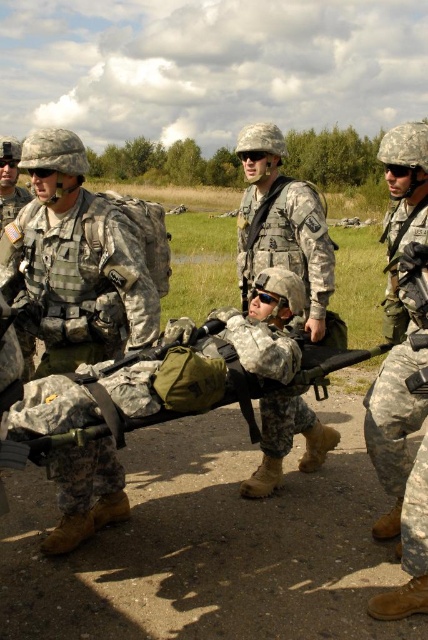
Question: Is the position of camouflage fabric uniform at center less distant than that of camouflage uniform at right?

Choices:
 (A) no
 (B) yes

Answer: (A)

Question: Is camouflage uniform at right to the right of camouflage uniform at center from the viewer's perspective?

Choices:
 (A) yes
 (B) no

Answer: (A)

Question: Among these points, which one is farthest from the camera?

Choices:
 (A) (412, 355)
 (B) (347, 364)

Answer: (A)

Question: Which of the following is the closest to the observer?

Choices:
 (A) (253, 204)
 (B) (398, 600)
 (C) (107, 516)

Answer: (B)

Question: Can you confirm if camouflage uniform at center is positioned to the left of camouflage fabric stretcher at center?

Choices:
 (A) no
 (B) yes

Answer: (A)

Question: Estimate the real-world distances between objects in this image. Which object is farther from the camouflage fabric uniform at center?

Choices:
 (A) camouflage fabric stretcher at center
 (B) camouflage uniform at center
 (C) camouflage uniform at right

Answer: (C)